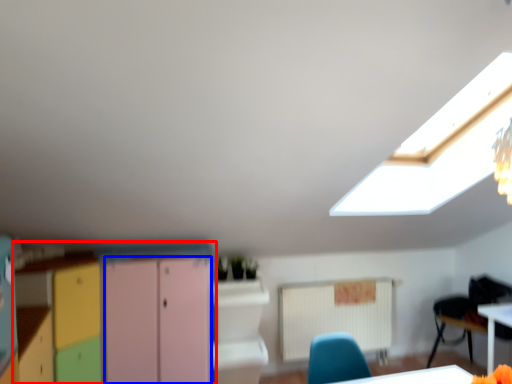
Question: Among these objects, which one is nearest to the camera, cabinetry (highlighted by a red box) or file cabinet (highlighted by a blue box)?

Choices:
 (A) cabinetry
 (B) file cabinet

Answer: (A)